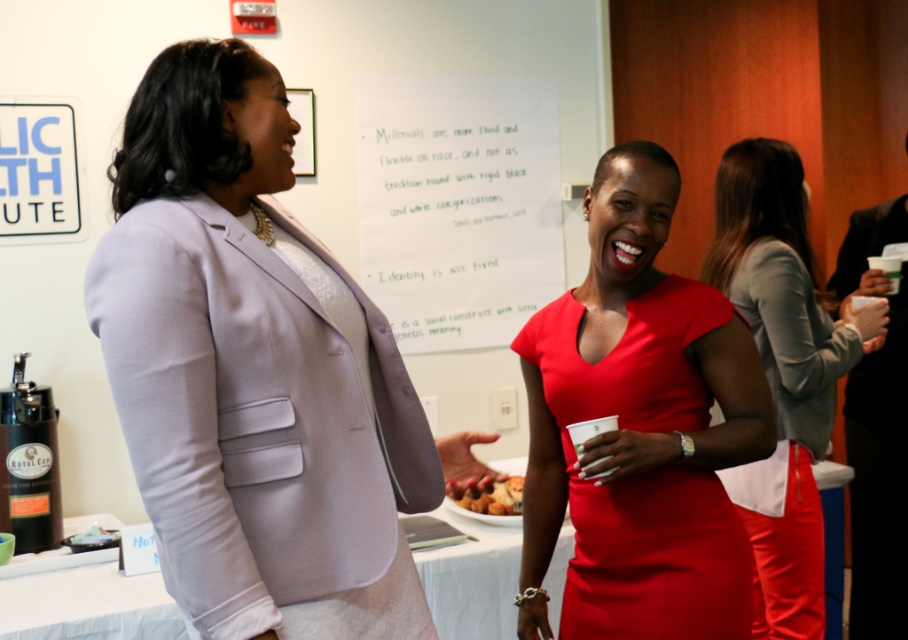
Who is more forward, (x=605, y=572) or (x=864, y=225)?

Point (x=605, y=572) is more forward.

Which is below, matte red dress at center or black smooth suit at right?

black smooth suit at right is lower down.

Is point (686, 422) positioned after point (870, 211)?

No, (686, 422) is in front of (870, 211).

Find the location of a particular element. matte red dress at center is located at coordinates (644, 476).

Who is higher up, lavender fabric blazer at upper left or golden brown crispy pastry at center?

lavender fabric blazer at upper left is above.

Is lavender fabric blazer at upper left taller than golden brown crispy pastry at center?

Yes, lavender fabric blazer at upper left is taller than golden brown crispy pastry at center.

Who is more forward, (324, 310) or (451, 480)?

Positioned in front is point (324, 310).

Find the location of a particular element. Image resolution: width=908 pixels, height=640 pixels. lavender fabric blazer at upper left is located at coordinates (249, 364).

Is lavender fabric blazer at upper left wider than matte red dress at center?

Yes, lavender fabric blazer at upper left is wider than matte red dress at center.

Is lavender fabric blazer at upper left above matte red dress at center?

Correct, lavender fabric blazer at upper left is located above matte red dress at center.

Is point (244, 413) less distant than point (663, 468)?

That is True.

Identify the location of lavender fabric blazer at upper left. The height and width of the screenshot is (640, 908). (249, 364).